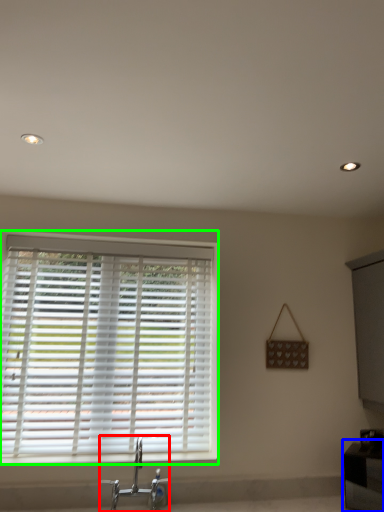
Question: Considering the real-world distances, which object is farthest from tap (highlighted by a red box)? vanity (highlighted by a blue box) or window blind (highlighted by a green box)?

Choices:
 (A) vanity
 (B) window blind

Answer: (A)